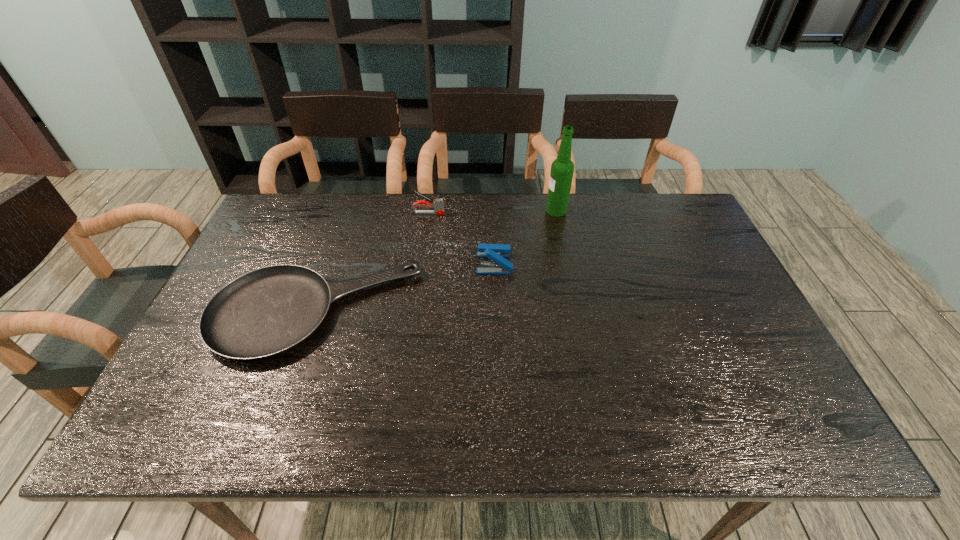
This screenshot has width=960, height=540. In the image, there is a desktop. In order to click on vacant space at the near right corner in this screenshot , I will do `click(798, 415)`.

Locate an element on the screen. The width and height of the screenshot is (960, 540). free spot between the frying pan and the farther stapler is located at coordinates (371, 263).

You are a GUI agent. You are given a task and a screenshot of the screen. Output one action in this format:
    pyautogui.click(x=<x>, y=<y>)
    Task: Click on the free space that is in between the tallest object and the farther stapler
    The height and width of the screenshot is (540, 960).
    Given the screenshot: What is the action you would take?
    pyautogui.click(x=492, y=212)

The height and width of the screenshot is (540, 960). I want to click on empty location between the tallest object and the farther stapler, so click(492, 212).

Locate an element on the screen. The image size is (960, 540). free space between the farther stapler and the frying pan is located at coordinates (371, 263).

Find the location of a particular element. This screenshot has width=960, height=540. free space between the nearer stapler and the shortest object is located at coordinates (404, 288).

Find the location of a particular element. The image size is (960, 540). vacant area that lies between the farther stapler and the tallest object is located at coordinates (492, 212).

Where is `vacant area between the nearer stapler and the left stapler`? The image size is (960, 540). vacant area between the nearer stapler and the left stapler is located at coordinates (461, 238).

Where is `free area in between the beer bottle and the left stapler`? The width and height of the screenshot is (960, 540). free area in between the beer bottle and the left stapler is located at coordinates (492, 212).

Find the location of a particular element. The image size is (960, 540). vacant area that lies between the shortest object and the rightmost object is located at coordinates (436, 261).